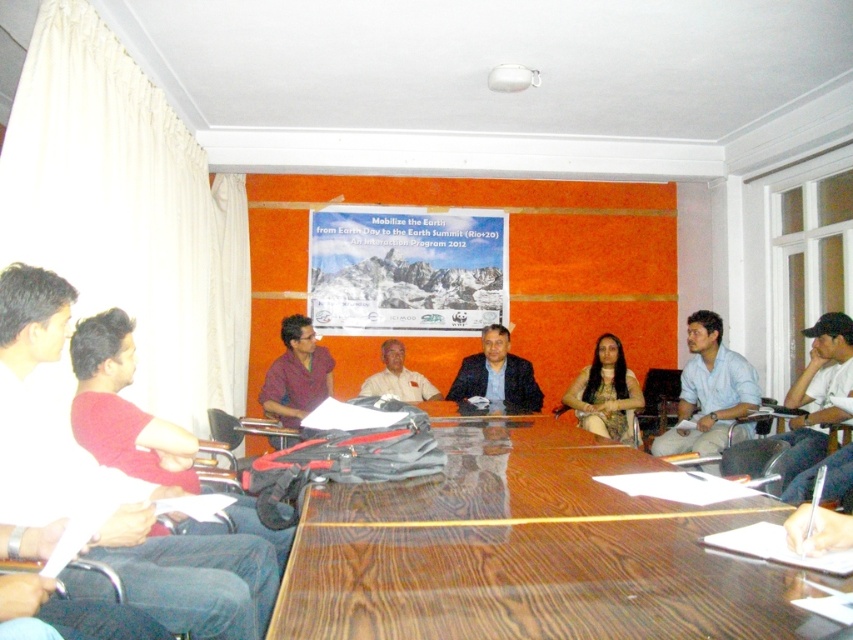
Based on the scene description, if you were standing at the front of the room facing the participants, which participant is positioned higher in your field of view between the red shirt at left and the light blue shirt at lower right?

The red shirt at left is positioned higher in your field of view because it is located above the light blue shirt at lower right.